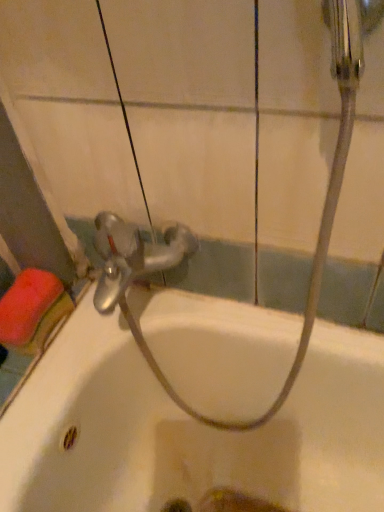
What do you see at coordinates (188, 430) in the screenshot? I see `white ceramic bath at center` at bounding box center [188, 430].

Where is `white ceramic bath at center`? Image resolution: width=384 pixels, height=512 pixels. white ceramic bath at center is located at coordinates (188, 430).

Where is `white ceramic bath at center`? white ceramic bath at center is located at coordinates (188, 430).